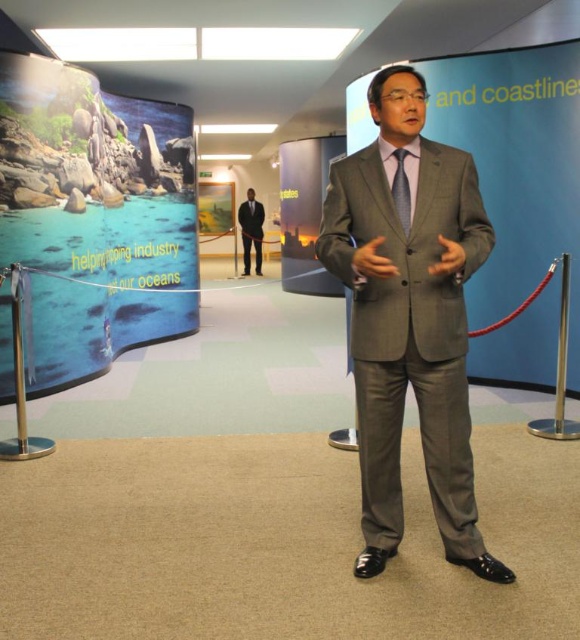
Which is behind, point (455, 372) or point (407, 234)?

Point (455, 372)

Between point (466, 218) and point (409, 200), which one is positioned behind?

The point (466, 218) is more distant.

Find the location of a particular element. This screenshot has width=580, height=640. gray wool suit at center is located at coordinates (409, 317).

Is gray wool suit at center to the left of black suit at center from the viewer's perspective?

Incorrect, gray wool suit at center is not on the left side of black suit at center.

Between point (358, 262) and point (255, 259), which one is positioned behind?

Positioned behind is point (255, 259).

Which is in front, point (462, 408) or point (238, 211)?

Point (462, 408) is in front.

Locate an element on the screen. gray wool suit at center is located at coordinates (409, 317).

Does gray wool suit at center have a greater width compared to blue silk tie at center?

Yes, gray wool suit at center is wider than blue silk tie at center.

Looking at this image, can you confirm if gray wool suit at center is taller than blue silk tie at center?

Yes.

Is point (389, 257) positioned in front of point (251, 198)?

Yes, it is in front of point (251, 198).

Identify the location of gray wool suit at center. (409, 317).